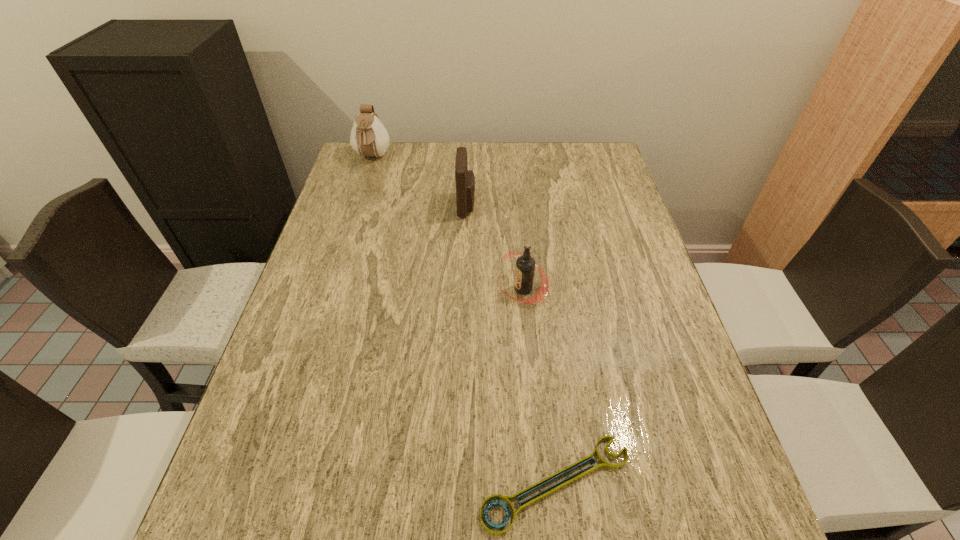
Locate an element on the screen. The width and height of the screenshot is (960, 540). empty space that is in between the left pouch and the nearest object is located at coordinates (464, 321).

Locate an element on the screen. Image resolution: width=960 pixels, height=540 pixels. free point between the leftmost object and the third object from right to left is located at coordinates point(420,181).

Locate an element on the screen. The image size is (960, 540). blank region between the leftmost object and the wrench is located at coordinates (464, 321).

Locate an element on the screen. empty space between the nearer pouch and the third farthest object is located at coordinates (494, 247).

At what (x,y) coordinates should I click in order to perform the action: click on vacant point located between the root beer and the nearest object. Please return your answer as a coordinate pair (x, y). Looking at the image, I should click on (540, 386).

Locate an element on the screen. The height and width of the screenshot is (540, 960). free spot between the right pouch and the root beer is located at coordinates (494, 247).

Find the location of a particular element. vacant space that's between the shortest object and the second nearest object is located at coordinates (540, 386).

This screenshot has height=540, width=960. I want to click on empty location between the third nearest object and the root beer, so click(494, 247).

You are a GUI agent. You are given a task and a screenshot of the screen. Output one action in this format:
    pyautogui.click(x=<x>, y=<y>)
    Task: Click on the vacant point located between the root beer and the shortest object
    
    Given the screenshot: What is the action you would take?
    pyautogui.click(x=540, y=386)

This screenshot has height=540, width=960. Identify the location of vacant space in between the second nearest object and the farther pouch. (447, 223).